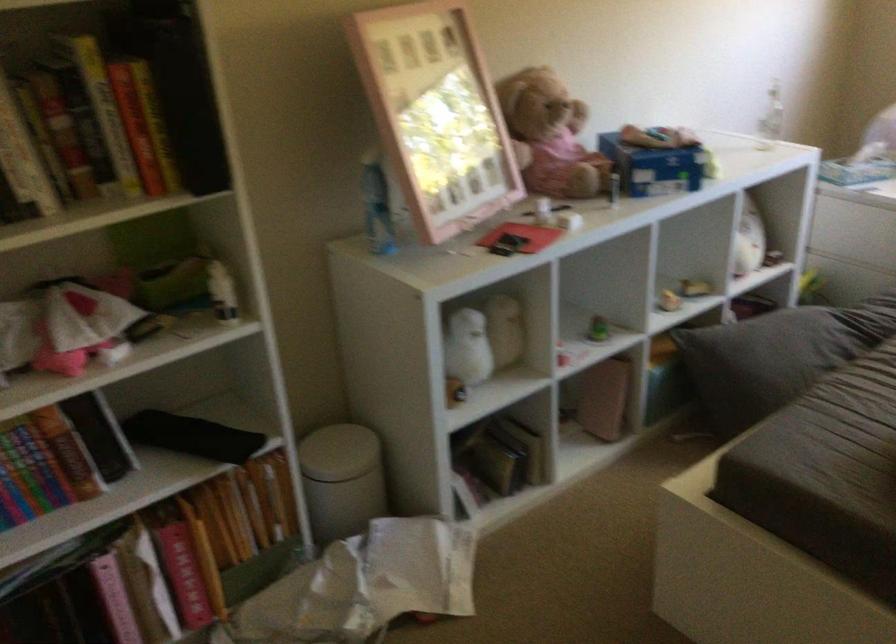
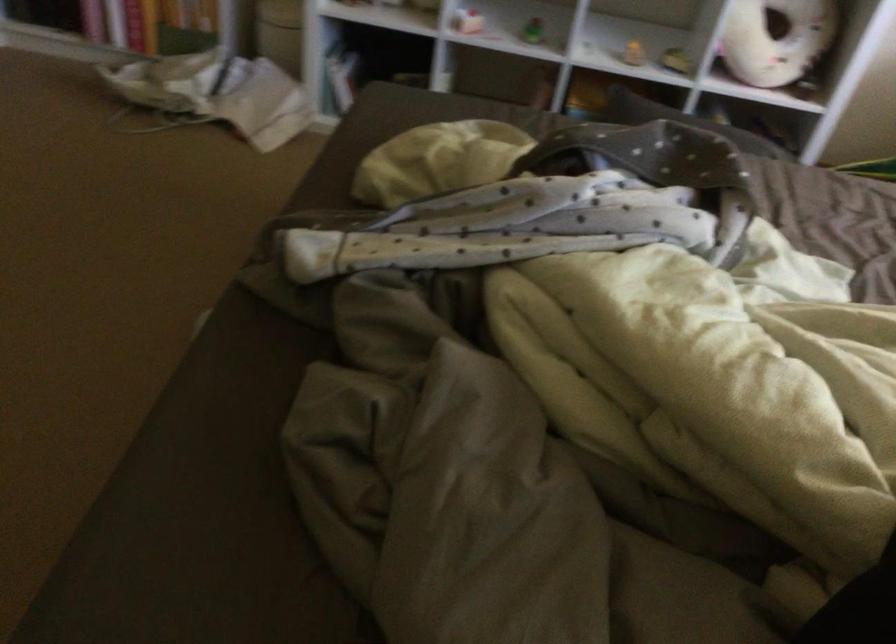
Question: I am providing you with two images of the same scene from different viewpoints. After the viewpoint changes to image2, which objects are now occluded?

Choices:
 (A) grey throw pillow
 (B) blue bag strap
 (C) book
 (D) donut-shaped pillow

Answer: (A)